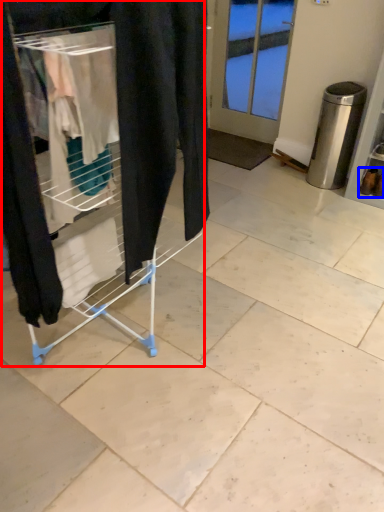
Question: Which object appears farthest to the camera in this image, furniture (highlighted by a red box) or footwear (highlighted by a blue box)?

Choices:
 (A) furniture
 (B) footwear

Answer: (B)